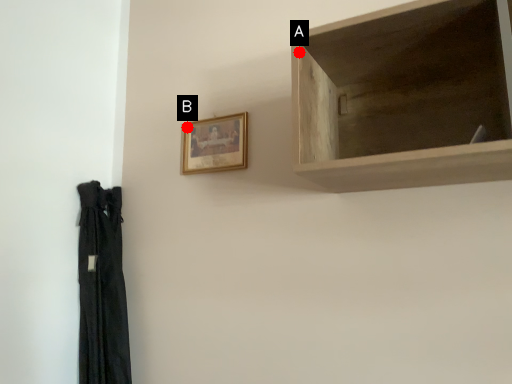
Question: Two points are circled on the image, labeled by A and B beside each circle. Among these points, which one is nearest to the camera?

Choices:
 (A) A is closer
 (B) B is closer

Answer: (A)